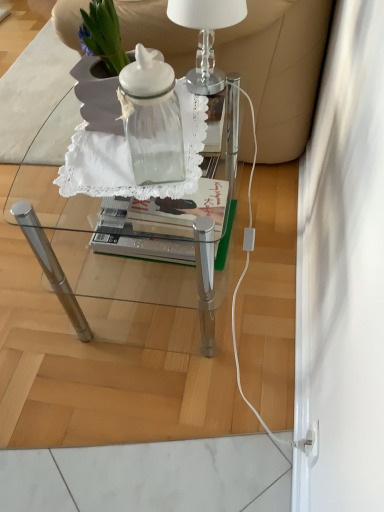
Question: Should I look upward or downward to see transparent glass jar at center?

Choices:
 (A) down
 (B) up

Answer: (B)

Question: From the image's perspective, is transparent glass jar at center on top of transparent glass table at center?

Choices:
 (A) no
 (B) yes

Answer: (B)

Question: Does transparent glass jar at center turn towards transparent glass table at center?

Choices:
 (A) no
 (B) yes

Answer: (A)

Question: Can you confirm if transparent glass jar at center is positioned to the right of transparent glass table at center?

Choices:
 (A) no
 (B) yes

Answer: (A)

Question: Does transparent glass jar at center come in front of transparent glass table at center?

Choices:
 (A) no
 (B) yes

Answer: (B)

Question: Is transparent glass jar at center at the left side of transparent glass table at center?

Choices:
 (A) no
 (B) yes

Answer: (B)

Question: Considering the relative positions of transparent glass jar at center and transparent glass table at center in the image provided, is transparent glass jar at center behind transparent glass table at center?

Choices:
 (A) yes
 (B) no

Answer: (B)

Question: From a real-world perspective, is white leather armchair at upper center on transparent glass table at center?

Choices:
 (A) no
 (B) yes

Answer: (B)

Question: Is white leather armchair at upper center closer to the viewer compared to transparent glass table at center?

Choices:
 (A) no
 (B) yes

Answer: (A)

Question: Considering the relative sizes of white leather armchair at upper center and transparent glass table at center in the image provided, is white leather armchair at upper center shorter than transparent glass table at center?

Choices:
 (A) yes
 (B) no

Answer: (B)

Question: From a real-world perspective, is white leather armchair at upper center under transparent glass table at center?

Choices:
 (A) no
 (B) yes

Answer: (A)

Question: Considering the relative sizes of white leather armchair at upper center and transparent glass table at center in the image provided, is white leather armchair at upper center wider than transparent glass table at center?

Choices:
 (A) no
 (B) yes

Answer: (B)

Question: Is white leather armchair at upper center outside transparent glass table at center?

Choices:
 (A) yes
 (B) no

Answer: (A)

Question: From the image's perspective, is clear glass table lamp at upper center located beneath transparent glass jar at center?

Choices:
 (A) yes
 (B) no

Answer: (B)